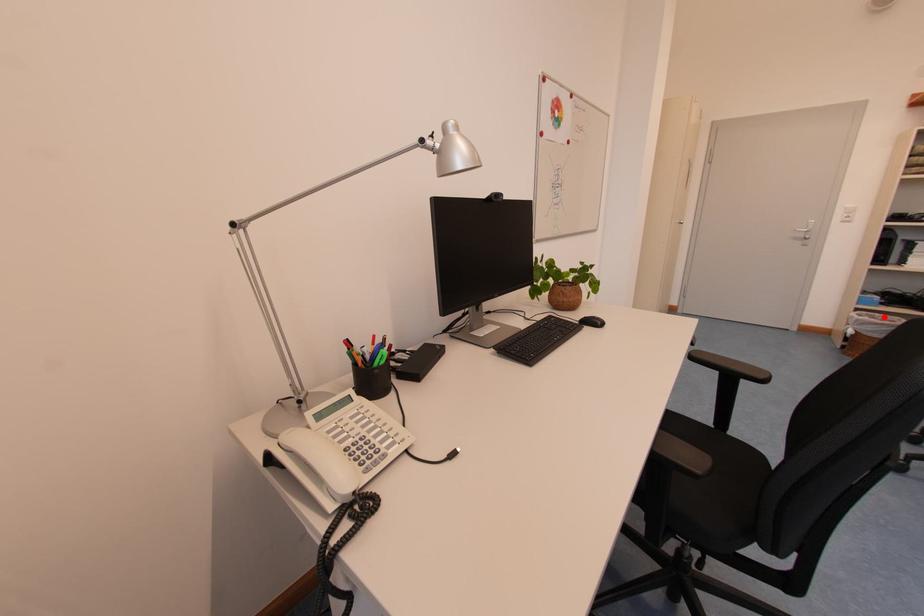
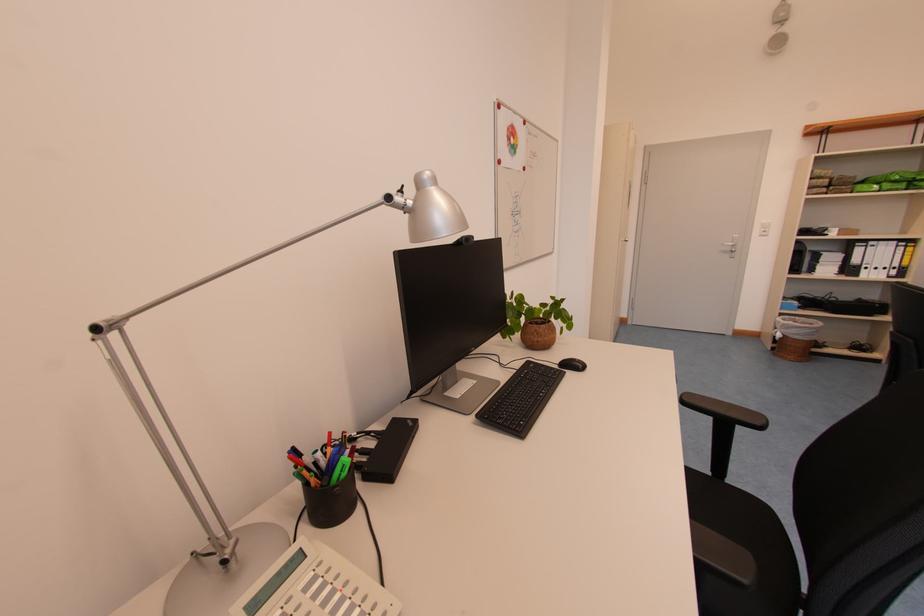
Question: I am providing you with two images of the same scene from different viewpoints. In image1, a red point is highlighted. Considering the same 3D point in image2, which of the following is correct?

Choices:
 (A) It is closer
 (B) It is farther

Answer: (A)